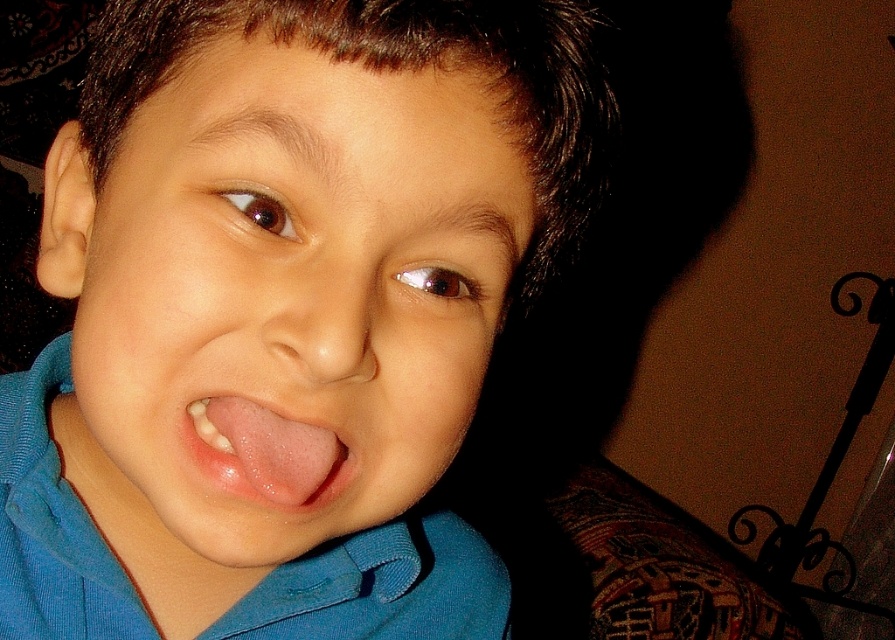
The child is wearing a blue cotton polo shirt at center and has a pink smooth tongue at center visible. Which one is positioned to the left?

The blue cotton polo shirt at center is to the left of the pink smooth tongue at center.

Based on the scene description, where is the blue cotton polo shirt at center located in terms of coordinates?

The blue cotton polo shirt at center is located at coordinates point (380, 588).

The child in the image has a smooth skin face at center and a pink smooth tongue at center. Which of these two features is taller?

The smooth skin face at center is taller than the pink smooth tongue at center.